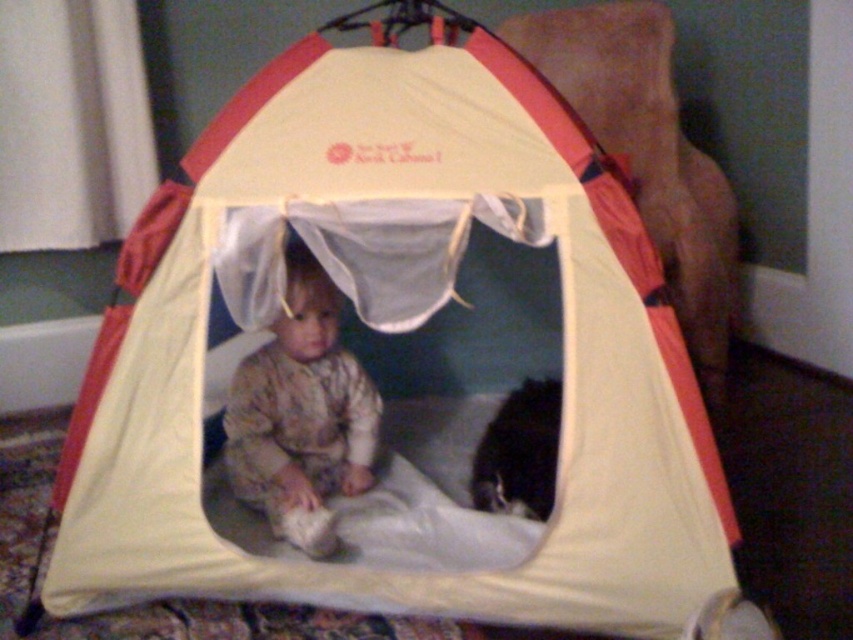
You are a parent trying to ensure your child is safe while playing in the tent. The camouflage fabric child at center is playing inside the tent, and the black fur cat at lower right is nearby. Based on their distance, can the child reach out and touch the cat without moving from their current position?

The camouflage fabric child at center and the black fur cat at lower right are 12.99 inches apart from each other. Since the distance is less than an arm length for a child, the child can likely reach out and touch the cat without moving from their current position.

You are a delivery robot entering the living room and need to navigate around the objects. The camouflage fabric child at center and the black fur cat at lower right are in your path. Which object should you avoid to ensure you have enough space to pass?

The camouflage fabric child at center might be wider than black fur cat at lower right, so you should avoid the camouflage fabric child at center to ensure enough space to pass.